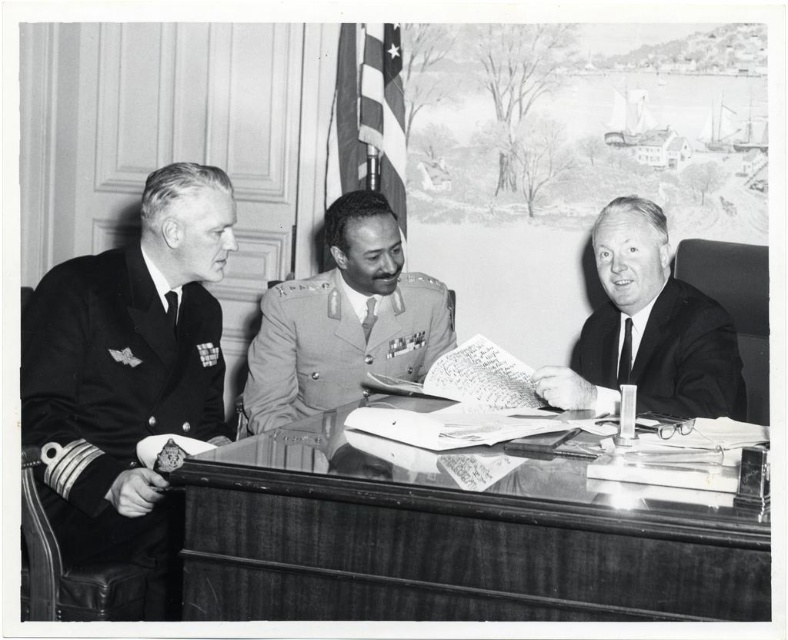
In the scene shown: Is uniformed officer at left thinner than uniform at center?

Yes, uniformed officer at left is thinner than uniform at center.

Is uniformed officer at left to the right of uniform at center from the viewer's perspective?

In fact, uniformed officer at left is to the left of uniform at center.

Describe the element at coordinates (129, 376) in the screenshot. I see `uniformed officer at left` at that location.

Where is `uniformed officer at left`? uniformed officer at left is located at coordinates (129, 376).

Is the position of uniformed officer at left less distant than that of smooth black suit at center?

Yes, it is.

Which is in front, point (80, 260) or point (571, 352)?

Point (80, 260) is in front.

Is point (132, 250) positioned after point (652, 356)?

No, it is in front of (652, 356).

Identify the location of uniformed officer at left. click(x=129, y=376).

Can you confirm if wooden table at center is positioned below uniform at center?

Correct, wooden table at center is located below uniform at center.

Does wooden table at center have a smaller size compared to uniform at center?

Incorrect, wooden table at center is not smaller in size than uniform at center.

Locate an element on the screen. Image resolution: width=788 pixels, height=640 pixels. wooden table at center is located at coordinates (448, 545).